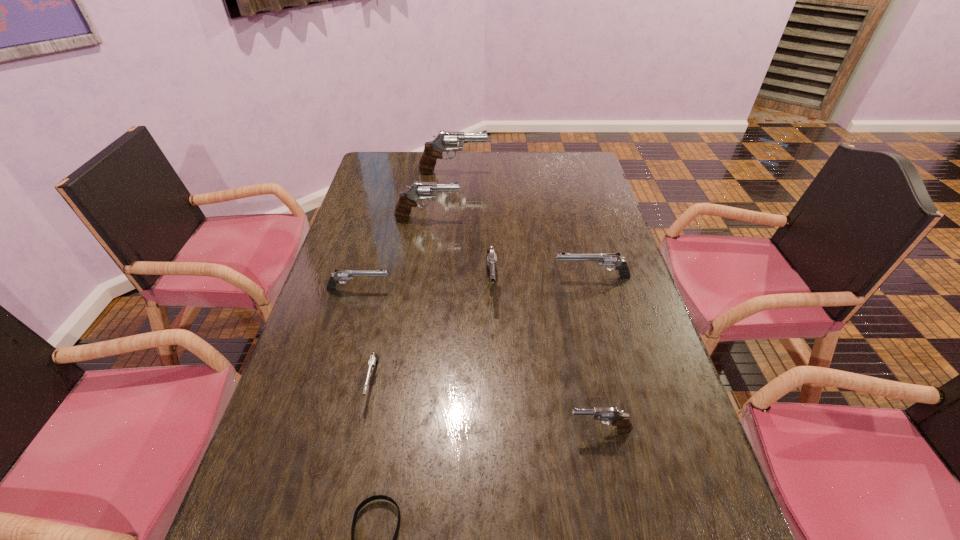
Where is `the second nearest silver pistol`? Image resolution: width=960 pixels, height=540 pixels. the second nearest silver pistol is located at coordinates (339, 275).

Where is `the third shortest object`? The width and height of the screenshot is (960, 540). the third shortest object is located at coordinates [339, 275].

The image size is (960, 540). Find the location of `the sixth farthest object`. the sixth farthest object is located at coordinates (374, 358).

Find the location of `the seventh tallest object`. the seventh tallest object is located at coordinates (374, 358).

Locate an element on the screen. The image size is (960, 540). vacant area located at the barrel of the tallest object is located at coordinates (x=540, y=172).

The height and width of the screenshot is (540, 960). In order to click on vacant area situated 0.320m at the barrel of the third nearest gray pistol in this screenshot , I will do `click(554, 218)`.

I want to click on vacant space situated at the barrel of the sixth shortest object, so click(x=494, y=381).

This screenshot has height=540, width=960. In order to click on free space located on the front-facing side of the farthest silver pistol in this screenshot , I will do `click(435, 277)`.

I want to click on free space located 0.270m on the front-facing side of the farthest silver pistol, so click(x=462, y=277).

I want to click on free point located on the front-facing side of the farthest silver pistol, so click(x=455, y=277).